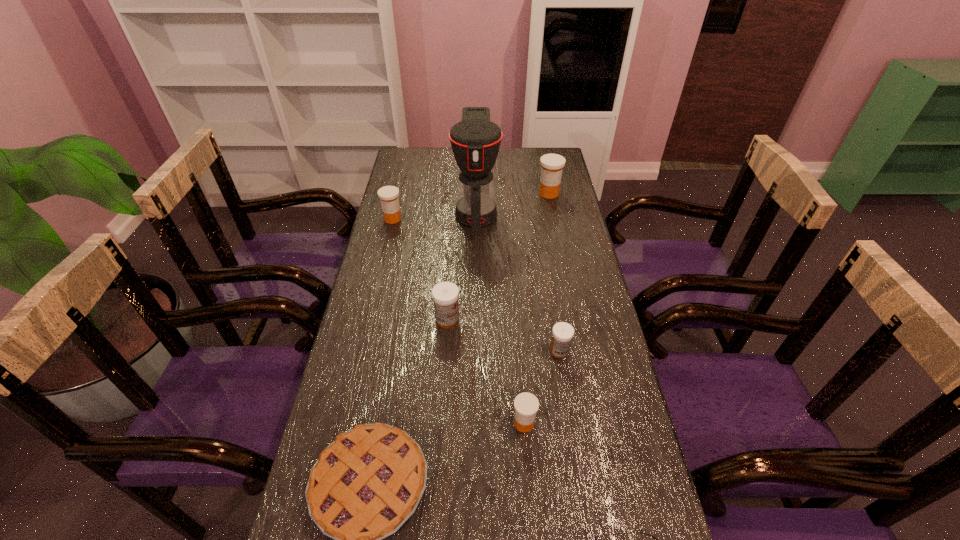
Identify the location of medicine identified as the third closest to the right white medicine. Image resolution: width=960 pixels, height=540 pixels. (552, 165).

Locate an element on the screen. Image resolution: width=960 pixels, height=540 pixels. orange medicine object that ranks as the second closest to the farther white medicine is located at coordinates (388, 195).

Locate which orange medicine ranks in proximity to the leftmost orange medicine. Please provide its 2D coordinates. Your answer should be formatted as a tuple, i.e. [(x, y)], where the tuple contains the x and y coordinates of a point satisfying the conditions above.

[(552, 165)]